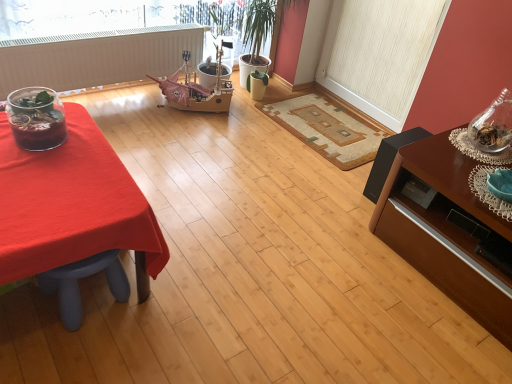
You are a GUI agent. You are given a task and a screenshot of the screen. Output one action in this format:
    pyautogui.click(x=<x>, y=<y>)
    Task: Click on the vacant space in beige woven mat at center (from a real-world perspective)
    Image resolution: width=512 pixels, height=384 pixels.
    Given the screenshot: What is the action you would take?
    pyautogui.click(x=315, y=125)